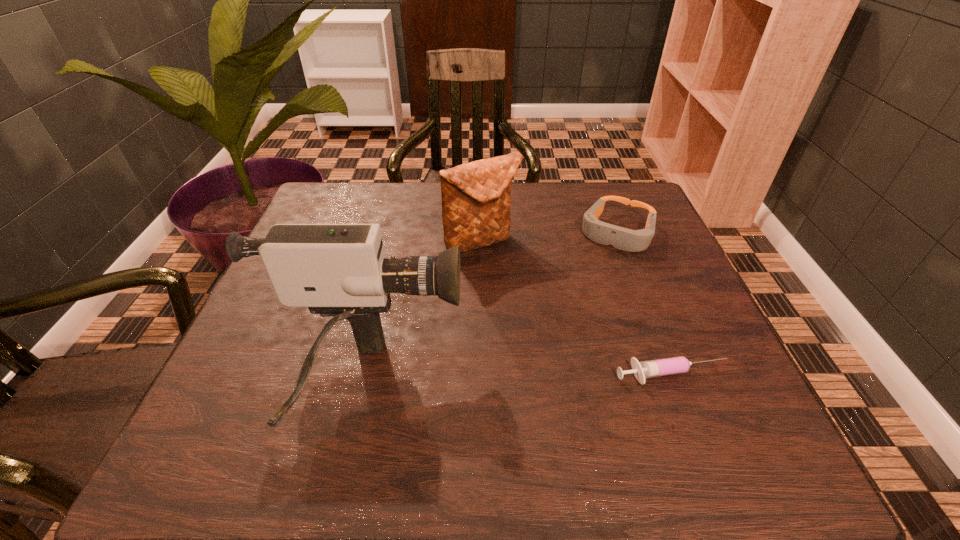
The image size is (960, 540). I want to click on vacant area between the clutch bag and the goggles, so click(x=550, y=237).

Where is `free space between the goggles and the tallest object`? free space between the goggles and the tallest object is located at coordinates (492, 307).

Find the location of `vacant space that is in between the shortest object and the goggles`. vacant space that is in between the shortest object and the goggles is located at coordinates (645, 305).

Where is `free space between the shortest object and the second tallest object`? This screenshot has width=960, height=540. free space between the shortest object and the second tallest object is located at coordinates (577, 309).

This screenshot has height=540, width=960. Find the location of `empty space that is in between the second shortest object and the clutch bag`. empty space that is in between the second shortest object and the clutch bag is located at coordinates (550, 237).

This screenshot has width=960, height=540. Identify the location of free area in between the syringe and the goggles. (645, 305).

This screenshot has width=960, height=540. I want to click on blank region between the shortest object and the camcorder, so click(x=518, y=379).

The height and width of the screenshot is (540, 960). In order to click on vacant space that is in between the syringe and the camcorder in this screenshot , I will do coord(518,379).

At what (x,y) coordinates should I click in order to perform the action: click on object that is the third closest to the tallest object. Please return your answer as a coordinate pair (x, y). Looking at the image, I should click on (604, 233).

I want to click on object that is the second closest to the syringe, so click(604, 233).